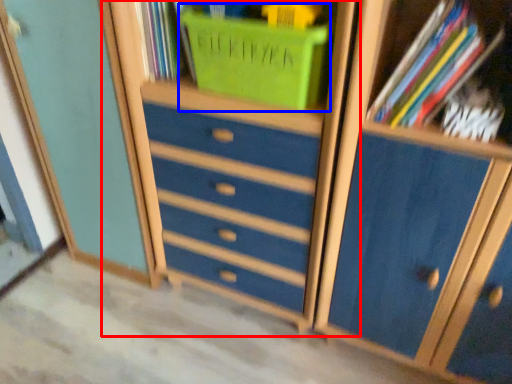
Question: Which object appears farthest to the camera in this image, dresser (highlighted by a red box) or basket (highlighted by a blue box)?

Choices:
 (A) dresser
 (B) basket

Answer: (B)